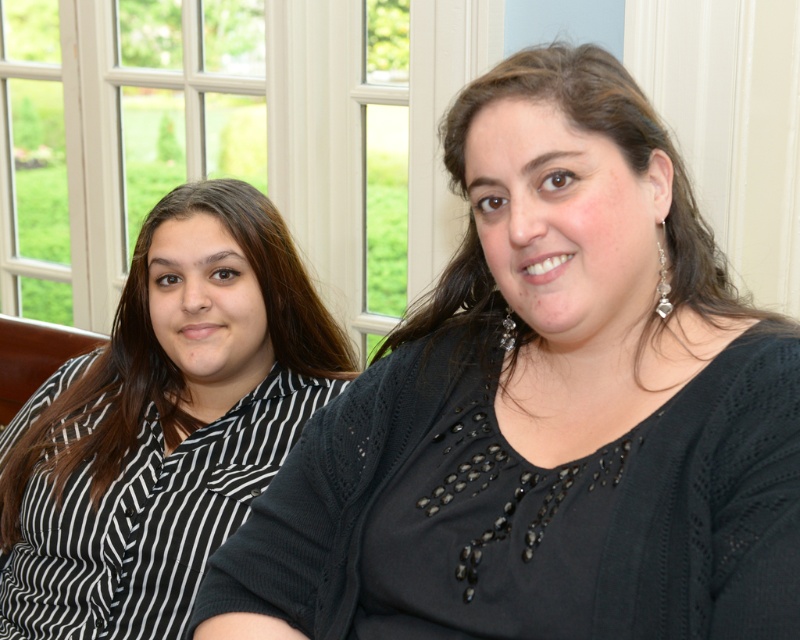
Is black knitted sweater at center wider than black striped shirt at left?

Correct, the width of black knitted sweater at center exceeds that of black striped shirt at left.

Is black knitted sweater at center above black striped shirt at left?

Yes, black knitted sweater at center is above black striped shirt at left.

The width and height of the screenshot is (800, 640). I want to click on black knitted sweater at center, so click(545, 410).

Identify the location of black knitted sweater at center. (545, 410).